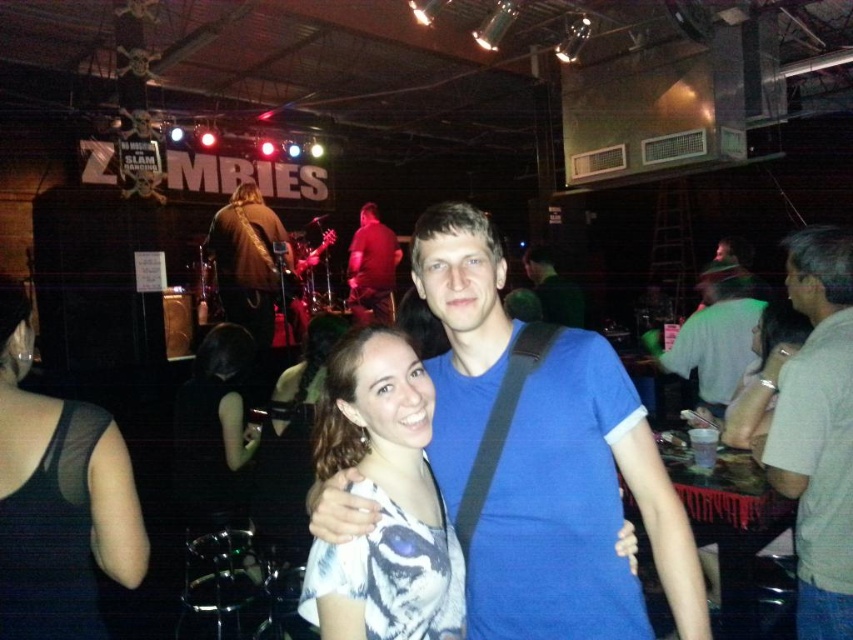
Question: Does green knit cap at upper center appear on the right side of blue cotton shirt at center?

Choices:
 (A) no
 (B) yes

Answer: (B)

Question: Which object appears closest to the camera in this image?

Choices:
 (A) gray cotton shirt at right
 (B) black mesh tank top at lower left

Answer: (B)

Question: Which point is farther to the camera?

Choices:
 (A) gray cotton shirt at right
 (B) blue cotton t-shirt at center
 (C) brown leather jacket at upper left
 (D) black mesh tank top at lower left

Answer: (C)

Question: Where is white printed shirt at center located in relation to dark brown hair at center in the image?

Choices:
 (A) right
 (B) left

Answer: (A)

Question: Is white printed shirt at center bigger than dark brown hair at center?

Choices:
 (A) yes
 (B) no

Answer: (B)

Question: Which point appears closest to the camera in this image?

Choices:
 (A) (722, 340)
 (B) (833, 406)
 (C) (527, 256)
 (D) (64, 600)

Answer: (D)